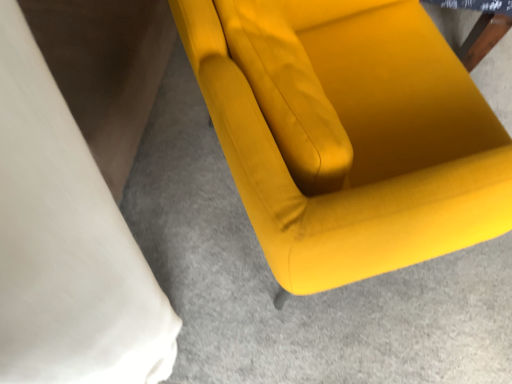
Measure the distance between matte yellow fabric chair at center and camera.

The depth of matte yellow fabric chair at center is 21.00 inches.

Identify the location of matte yellow fabric chair at center. The image size is (512, 384). (362, 147).

Image resolution: width=512 pixels, height=384 pixels. Describe the element at coordinates (362, 147) in the screenshot. I see `matte yellow fabric chair at center` at that location.

Find the location of a particular element. The image size is (512, 384). matte yellow fabric chair at center is located at coordinates (362, 147).